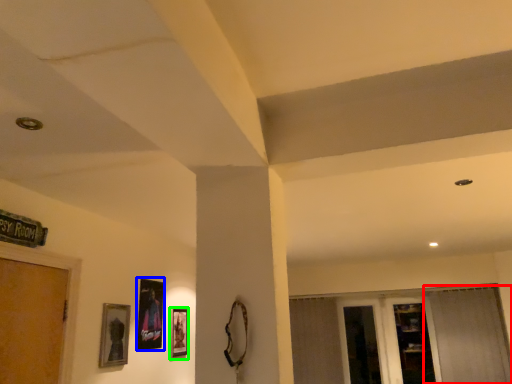
Question: Based on their relative distances, which object is farther from curtain (highlighted by a red box)? Choose from picture frame (highlighted by a blue box) and picture frame (highlighted by a green box).

Choices:
 (A) picture frame
 (B) picture frame

Answer: (A)